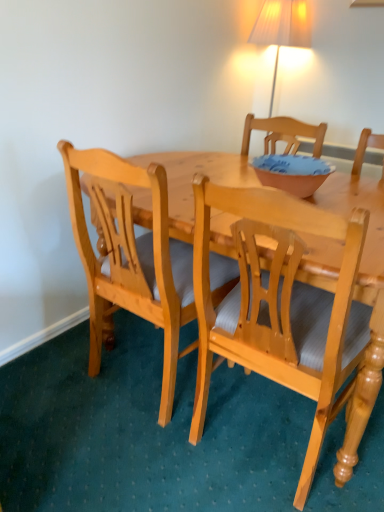
Where is `vacant space positioned to the left of light wood chair at center, the second chair viewed from the right`? The width and height of the screenshot is (384, 512). vacant space positioned to the left of light wood chair at center, the second chair viewed from the right is located at coordinates (67, 392).